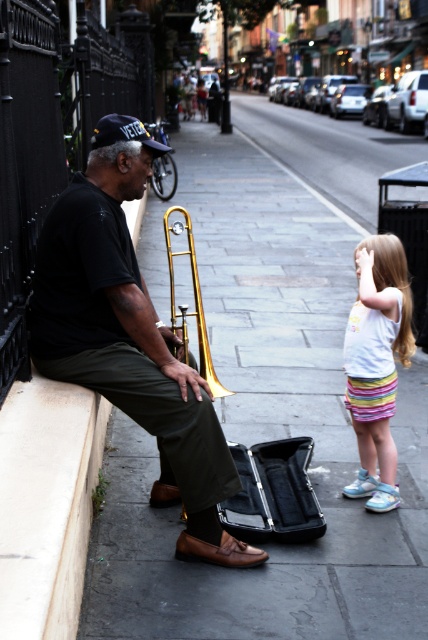
Which is in front, point (189, 237) or point (112, 122)?

Point (112, 122) is more forward.

At what (x,y) coordinates should I click in order to perform the action: click on gold brass trombone at center. Please return your answer as a coordinate pair (x, y). Image resolution: width=428 pixels, height=640 pixels. Looking at the image, I should click on (187, 305).

Where is `gold brass trombone at center`? The height and width of the screenshot is (640, 428). gold brass trombone at center is located at coordinates (187, 305).

Is dark gray stone pavement at lower left further to camera compared to blue denim baseball cap at left?

No, dark gray stone pavement at lower left is closer to the viewer.

Is point (336, 262) more distant than point (146, 144)?

Yes, point (336, 262) is farther from viewer.

The height and width of the screenshot is (640, 428). In order to click on dark gray stone pavement at lower left in this screenshot , I will do `click(267, 429)`.

Identify the location of dark gray stone pavement at lower left. This screenshot has width=428, height=640. (267, 429).

Locate an element on the screen. pastel striped skirt at lower right is located at coordinates (377, 364).

Based on the photo, is pastel striped skirt at lower right below gold brass trombone at center?

Yes.

Between point (344, 356) and point (216, 394), which one is positioned in front?

Point (216, 394)

At what (x,y) coordinates should I click in order to perform the action: click on pastel striped skirt at lower right. Please return your answer as a coordinate pair (x, y). Looking at the image, I should click on (377, 364).